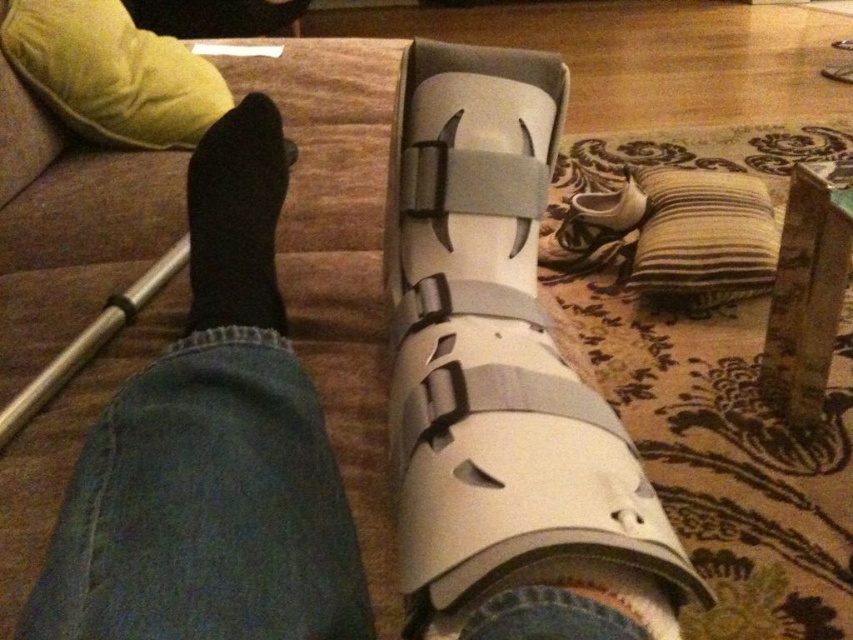
Question: Is velvet yellow pillow at upper left bigger than striped fabric pillow at lower right?

Choices:
 (A) yes
 (B) no

Answer: (B)

Question: Based on their relative distances, which object is farther from the white matte cast at center?

Choices:
 (A) striped fabric pillow at lower right
 (B) black sock at left
 (C) velvet yellow pillow at upper left

Answer: (A)

Question: Which object is farther from the camera taking this photo?

Choices:
 (A) white matte cast at center
 (B) black rubber crutch at left

Answer: (B)

Question: Is white matte sock at lower center thinner than striped fabric pillow at lower right?

Choices:
 (A) no
 (B) yes

Answer: (B)

Question: From the image, what is the correct spatial relationship of black sock at left in relation to black rubber crutch at left?

Choices:
 (A) right
 (B) left

Answer: (A)

Question: Which of the following is the farthest from the observer?

Choices:
 (A) (646, 552)
 (B) (216, 376)
 (C) (67, 372)

Answer: (C)